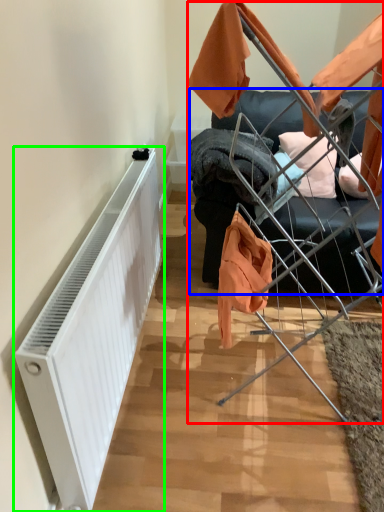
Question: Considering the real-world distances, which object is closest to baby carriage (highlighted by a red box)? furniture (highlighted by a blue box) or radiator (highlighted by a green box).

Choices:
 (A) furniture
 (B) radiator

Answer: (A)